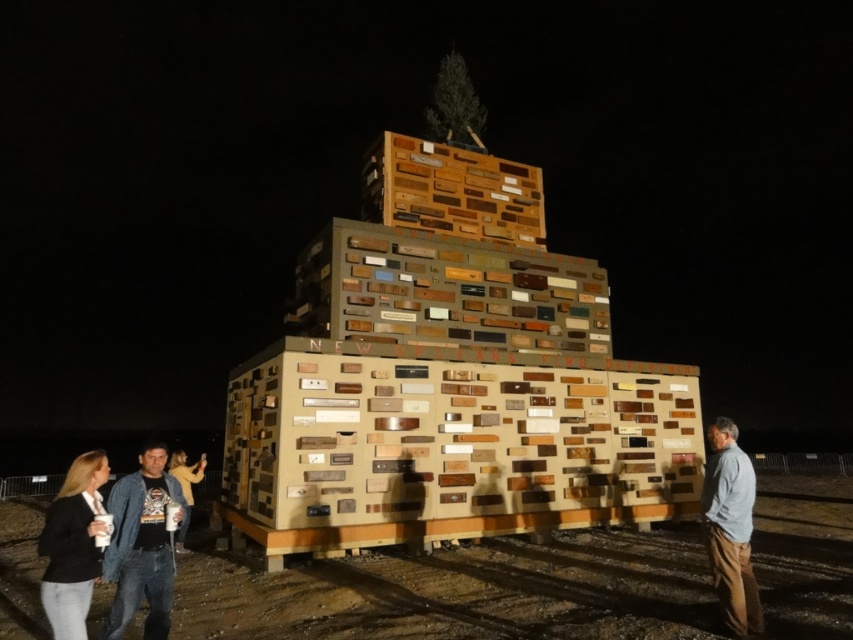
You are standing in front of the nighttime monument and want to determine the relative positions of two points on it. The first point is located at coordinates point (155, 637) and the second at point (737, 554). Based on the structure, which point is closer to your viewpoint?

Point (155, 637) is closer to the camera than point (737, 554).

Based on the photo, you are standing in front of the nighttime monument and see both the denim jacket at lower left and the gray cotton shirt at lower right. Which clothing item is closer to you?

The denim jacket at lower left is closer to you because it is in front of the gray cotton shirt at lower right.

You are standing in front of the nighttime monument and see the point marked as point (141, 545). What object is located at that point?

The point (141, 545) corresponds to the denim jacket at lower left.